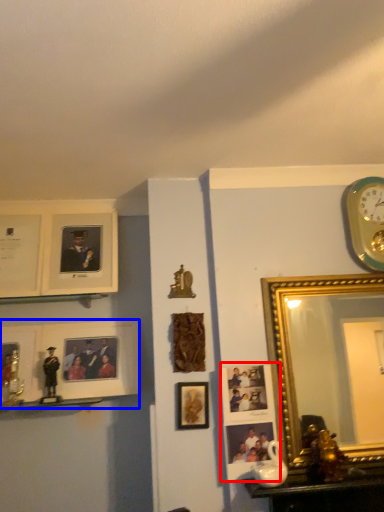
Question: Which of the following is the farthest to the observer, picture frame (highlighted by a red box) or picture frame (highlighted by a blue box)?

Choices:
 (A) picture frame
 (B) picture frame

Answer: (B)